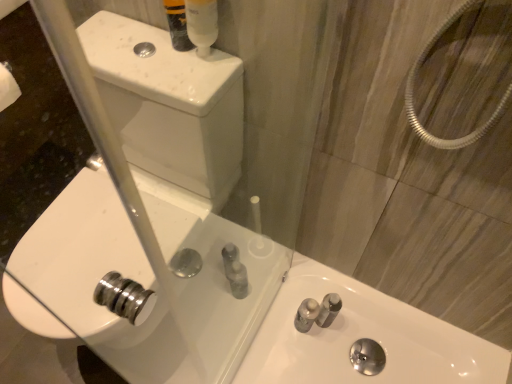
Question: From the image's perspective, is translucent plastic mouthwash at upper center on top of white glossy sink at lower right, the first sink positioned from the right?

Choices:
 (A) no
 (B) yes

Answer: (B)

Question: Is there a large distance between translucent plastic mouthwash at upper center and white glossy sink at lower right, the 2th sink when ordered from left to right?

Choices:
 (A) no
 (B) yes

Answer: (A)

Question: Could you tell me if translucent plastic mouthwash at upper center is facing white glossy sink at lower right, the 2th sink when ordered from left to right?

Choices:
 (A) no
 (B) yes

Answer: (A)

Question: Does translucent plastic mouthwash at upper center appear on the left side of white glossy sink at lower right, the 2th sink when ordered from left to right?

Choices:
 (A) no
 (B) yes

Answer: (B)

Question: Can you confirm if translucent plastic mouthwash at upper center is thinner than white glossy sink at lower right, the first sink positioned from the right?

Choices:
 (A) yes
 (B) no

Answer: (A)

Question: Can you confirm if translucent plastic mouthwash at upper center is shorter than white glossy sink at lower right, the first sink positioned from the right?

Choices:
 (A) no
 (B) yes

Answer: (A)

Question: Can you confirm if white glossy sink at lower right, the 2th sink when ordered from left to right, is shorter than translucent plastic tube at upper center?

Choices:
 (A) no
 (B) yes

Answer: (B)

Question: Does white glossy sink at lower right, the first sink positioned from the right, have a smaller size compared to translucent plastic tube at upper center?

Choices:
 (A) yes
 (B) no

Answer: (B)

Question: Is white glossy sink at lower right, the first sink positioned from the right, at the left side of translucent plastic tube at upper center?

Choices:
 (A) no
 (B) yes

Answer: (A)

Question: Is white glossy sink at lower right, the first sink positioned from the right, with translucent plastic tube at upper center?

Choices:
 (A) yes
 (B) no

Answer: (B)

Question: From a real-world perspective, is white glossy sink at lower right, the 2th sink when ordered from left to right, on top of translucent plastic tube at upper center?

Choices:
 (A) yes
 (B) no

Answer: (B)

Question: Is white glossy sink at lower right, the first sink positioned from the right, positioned behind translucent plastic tube at upper center?

Choices:
 (A) no
 (B) yes

Answer: (B)

Question: Can you confirm if white glossy sink at lower right, the 2th sink when ordered from left to right, is smaller than white glossy sink at center, which is counted as the first sink, starting from the left?

Choices:
 (A) yes
 (B) no

Answer: (A)